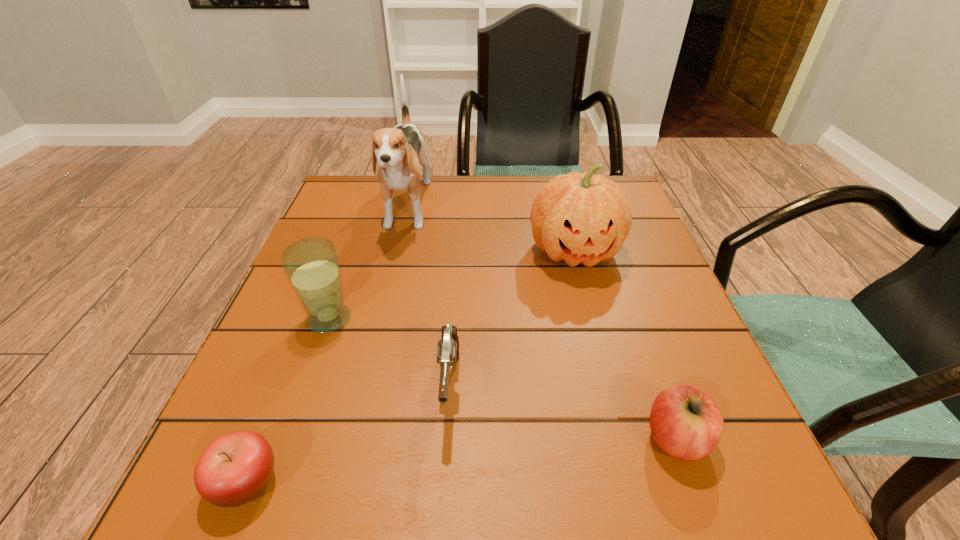
At what (x,y) coordinates should I click in order to perform the action: click on free region located 0.250m on the front of the third farthest object. Please return your answer as a coordinate pair (x, y). Looking at the image, I should click on (270, 484).

Identify the location of free spot located at the barrel of the fourth object from left to right. (444, 474).

Identify the location of vacant area situated 0.390m on the back of the right apple. This screenshot has width=960, height=540. (608, 248).

Find the location of a particular element. free space located on the back of the left apple is located at coordinates (298, 353).

Identify the location of puppy present at the far edge. (399, 151).

Find the location of a particular element. Image resolution: width=960 pixels, height=540 pixels. pumpkin at the far edge is located at coordinates (584, 218).

Find the location of a particular element. The width and height of the screenshot is (960, 540). puppy present at the left edge is located at coordinates (399, 151).

Locate an element on the screen. glass that is at the left edge is located at coordinates 312,266.

I want to click on apple that is at the left edge, so click(236, 467).

Where is `pumpkin located at the right edge`? Image resolution: width=960 pixels, height=540 pixels. pumpkin located at the right edge is located at coordinates (584, 218).